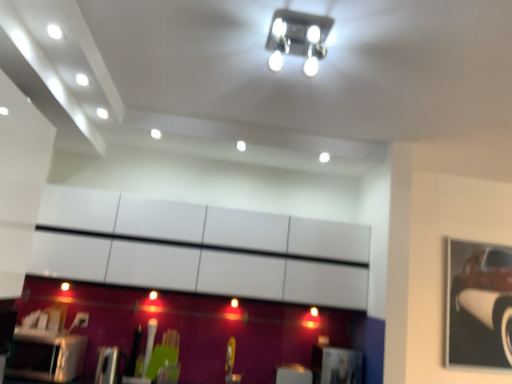
Question: Should I look upward or downward to see metallic square light fixture at upper center?

Choices:
 (A) down
 (B) up

Answer: (B)

Question: From the image's perspective, is metallic square light fixture at upper center over metallic car at right?

Choices:
 (A) yes
 (B) no

Answer: (A)

Question: Is metallic car at right located within metallic square light fixture at upper center?

Choices:
 (A) yes
 (B) no

Answer: (B)

Question: Is metallic square light fixture at upper center positioned with its back to metallic car at right?

Choices:
 (A) yes
 (B) no

Answer: (B)

Question: Is metallic square light fixture at upper center bigger than metallic car at right?

Choices:
 (A) no
 (B) yes

Answer: (A)

Question: Does metallic square light fixture at upper center appear on the right side of metallic car at right?

Choices:
 (A) no
 (B) yes

Answer: (A)

Question: Could you tell me if metallic square light fixture at upper center is facing metallic car at right?

Choices:
 (A) no
 (B) yes

Answer: (A)

Question: Is metallic car at right positioned in front of metallic square light fixture at upper center?

Choices:
 (A) yes
 (B) no

Answer: (B)

Question: From the image's perspective, is metallic car at right under metallic square light fixture at upper center?

Choices:
 (A) no
 (B) yes

Answer: (B)

Question: Does metallic car at right have a lesser width compared to metallic square light fixture at upper center?

Choices:
 (A) no
 (B) yes

Answer: (B)

Question: Would you say metallic car at right is outside metallic square light fixture at upper center?

Choices:
 (A) no
 (B) yes

Answer: (B)

Question: Does metallic car at right appear on the right side of metallic square light fixture at upper center?

Choices:
 (A) no
 (B) yes

Answer: (B)

Question: Is metallic car at right far from metallic square light fixture at upper center?

Choices:
 (A) yes
 (B) no

Answer: (A)

Question: Is metallic silver toaster at lower left to the left of metallic car at right from the viewer's perspective?

Choices:
 (A) no
 (B) yes

Answer: (B)